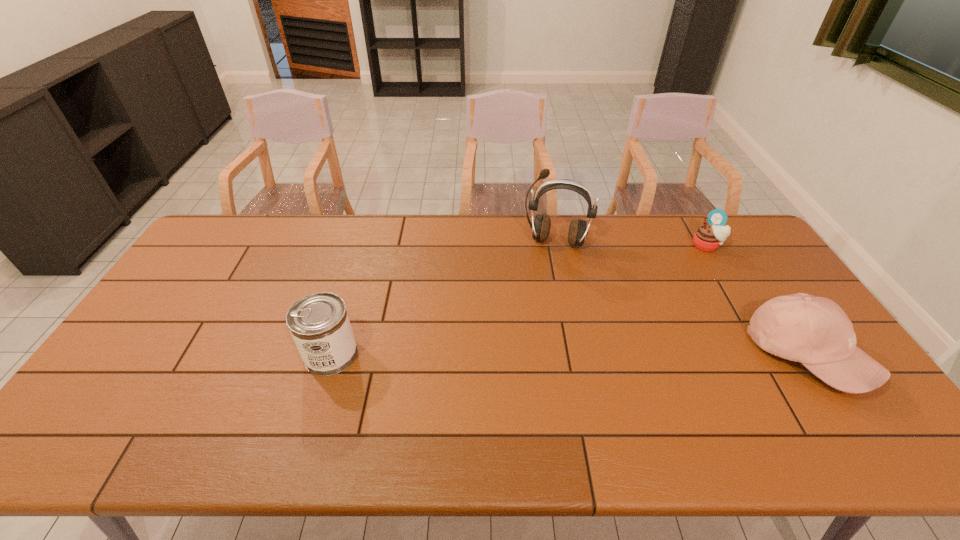
Identify the location of can. This screenshot has width=960, height=540. (319, 324).

The image size is (960, 540). In order to click on baseball cap in this screenshot , I will do `click(815, 331)`.

Find the location of `the second object from left to right`. the second object from left to right is located at coordinates (578, 230).

Where is `the tallest object`? The height and width of the screenshot is (540, 960). the tallest object is located at coordinates (578, 230).

The image size is (960, 540). I want to click on muffin, so click(x=708, y=237).

This screenshot has height=540, width=960. Find the location of `vacant space positioned on the back of the can`. vacant space positioned on the back of the can is located at coordinates (363, 248).

Locate an element on the screen. This screenshot has width=960, height=540. vacant space situated 0.380m on the ear pads of the tallest object is located at coordinates (535, 340).

This screenshot has height=540, width=960. I want to click on vacant point located on the ear pads of the tallest object, so click(545, 282).

This screenshot has width=960, height=540. In order to click on vacant space located on the ear pads of the tallest object in this screenshot , I will do `click(538, 323)`.

Where is `vacant space situated on the front-facing side of the shortest object`? The image size is (960, 540). vacant space situated on the front-facing side of the shortest object is located at coordinates [645, 317].